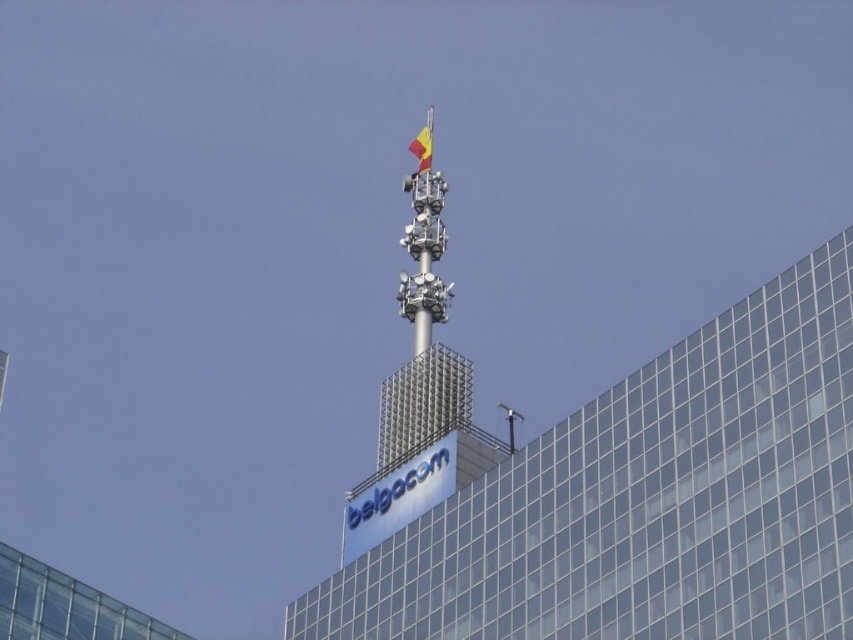
Does metallic grid spire at upper center come in front of yellow fabric flag at upper center?

Yes, metallic grid spire at upper center is in front of yellow fabric flag at upper center.

The height and width of the screenshot is (640, 853). In order to click on metallic grid spire at upper center in this screenshot , I will do `click(422, 337)`.

Where is `metallic grid spire at upper center`? This screenshot has height=640, width=853. metallic grid spire at upper center is located at coordinates (422, 337).